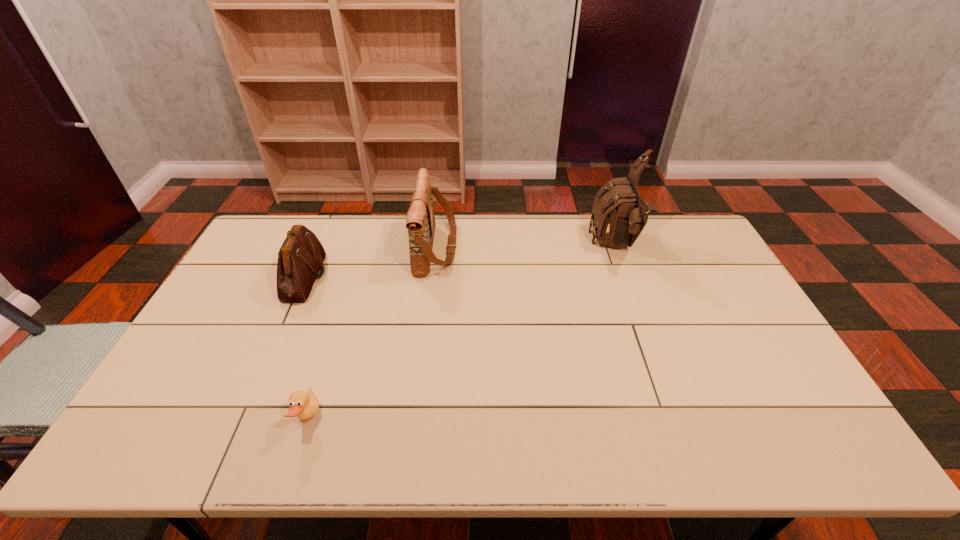
Where is `free spot between the third object from left to right and the tallest object`? Image resolution: width=960 pixels, height=540 pixels. free spot between the third object from left to right and the tallest object is located at coordinates (526, 247).

Where is `the second closest object to the leftmost object`? the second closest object to the leftmost object is located at coordinates (305, 405).

You are a GUI agent. You are given a task and a screenshot of the screen. Output one action in this format:
    pyautogui.click(x=<x>, y=<y>)
    Task: Click on the object that is the closest to the duck
    
    Given the screenshot: What is the action you would take?
    pyautogui.click(x=301, y=256)

Image resolution: width=960 pixels, height=540 pixels. Find the location of `shoulder bag that stands as the second closest to the tallest object`. shoulder bag that stands as the second closest to the tallest object is located at coordinates (301, 256).

Select which shoulder bag is the third closest to the nearest object. Please provide its 2D coordinates. Your answer should be formatted as a tuple, i.e. [(x, y)], where the tuple contains the x and y coordinates of a point satisfying the conditions above.

[(619, 214)]

In order to click on vacant space that satisfies the following two spatial constraints: 1. on the front-facing side of the third shortest object; 2. on the front side of the third tallest object in this screenshot , I will do `click(433, 278)`.